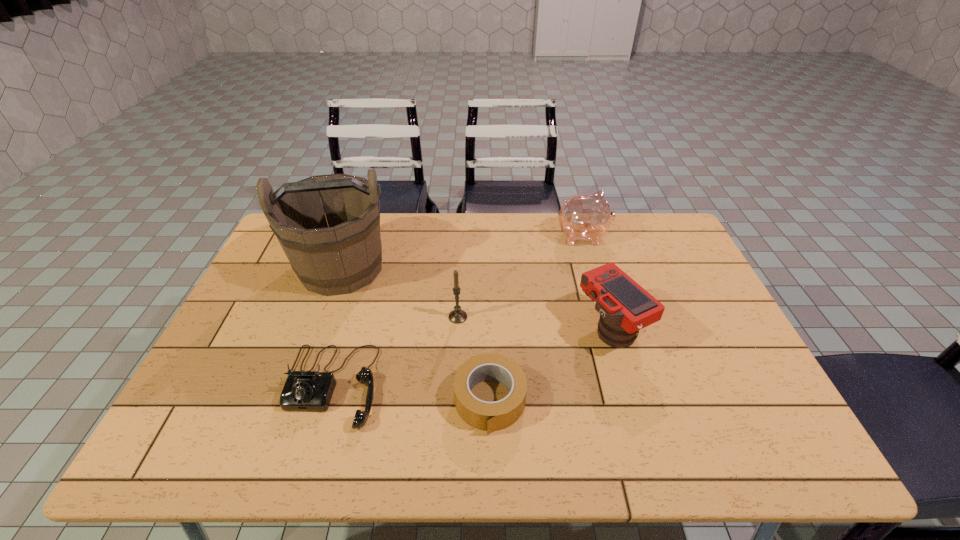
The width and height of the screenshot is (960, 540). Find the location of `bucket`. bucket is located at coordinates (330, 257).

Find the location of a particular element. candle is located at coordinates (457, 316).

Where is `piggy bank`? This screenshot has height=540, width=960. piggy bank is located at coordinates (587, 217).

Identify the location of camera. This screenshot has width=960, height=540. (625, 307).

Where is `telephone`? The height and width of the screenshot is (540, 960). telephone is located at coordinates [x=310, y=390].

Locate an element on the screen. This screenshot has width=960, height=540. the shortest object is located at coordinates (488, 416).

Identify the location of blank space located 0.180m on the front of the bucket. This screenshot has height=540, width=960. (311, 352).

Where is `free space located on the back of the candle`? The image size is (960, 540). free space located on the back of the candle is located at coordinates (459, 295).

Identify the location of vacant space located on the front facing side of the piggy bank. (668, 236).

Identify the location of free region located 0.180m on the left of the camera. This screenshot has width=960, height=540. (512, 328).